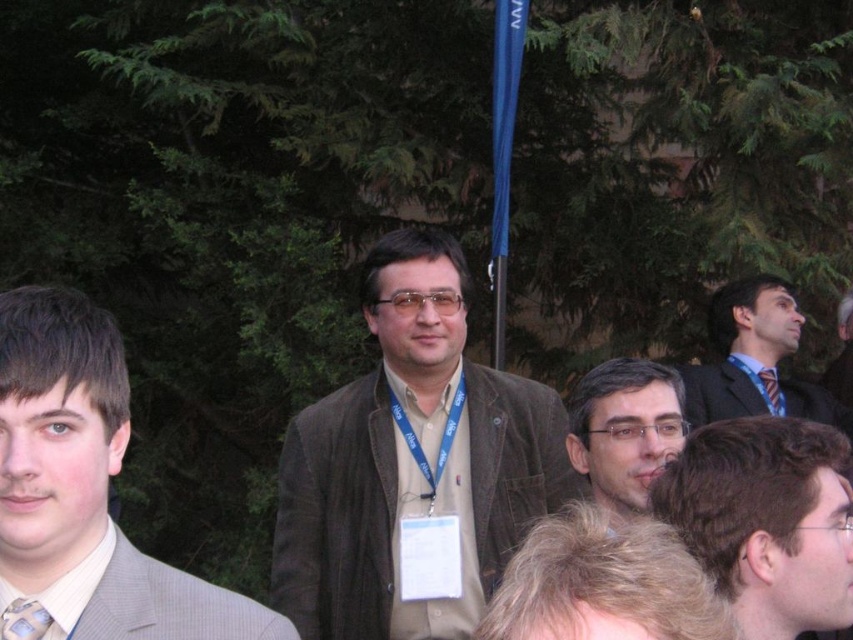
Question: Does light brown suit at left have a larger size compared to light blue silk tie at center?

Choices:
 (A) yes
 (B) no

Answer: (A)

Question: Which of the following is the farthest from the observer?

Choices:
 (A) (651, 420)
 (B) (13, 611)
 (C) (796, 406)

Answer: (C)

Question: Which point appears closest to the camera in this image?

Choices:
 (A) (793, 408)
 (B) (598, 432)
 (C) (386, 472)
 (D) (802, 436)

Answer: (D)

Question: Is matte brown hair at center closer to the viewer compared to blue striped tie at right?

Choices:
 (A) no
 (B) yes

Answer: (B)

Question: Considering the real-world distances, which object is farthest from the brown suede jacket at center?

Choices:
 (A) blue striped tie at right
 (B) light brown suit at left
 (C) dark blue suit at center
 (D) smooth brown hair at center

Answer: (A)

Question: Observing the image, what is the correct spatial positioning of brown suede jacket at center in reference to light brown suit at left?

Choices:
 (A) left
 (B) right

Answer: (B)